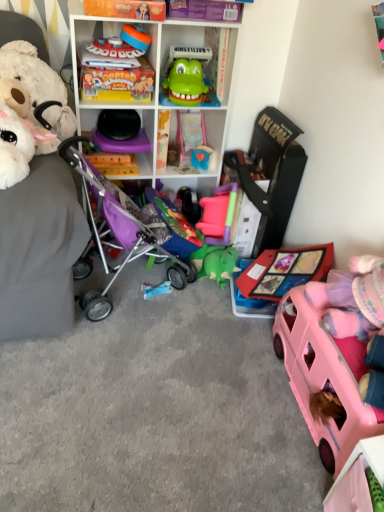
You are a GUI agent. You are given a task and a screenshot of the screen. Output one action in this format:
    pyautogui.click(x=<x>, y=<y>)
    Task: Click on the matte yellow book at upper center
    This screenshot has height=512, width=384.
    Given the screenshot: What is the action you would take?
    pyautogui.click(x=117, y=83)

Describe the element at coordinates (324, 377) in the screenshot. I see `pink plastic car at lower right, which is the 1th toy in right-to-left order` at that location.

Measure the distance between matte plastic game controller at upper center, the 2th toy in the left-to-right sequence, and camera.

5.20 feet.

In order to face green plastic toy at upper center, marked as the fifth toy in a left-to-right arrangement, should I rotate leftwards or rightwards?

It's best to rotate left around 0.121 degrees.

Locate an element on the screen. The image size is (384, 512). green plastic toy at upper center, marked as the fifth toy in a left-to-right arrangement is located at coordinates (186, 83).

Identify the location of matte yellow book at upper center. (117, 83).

Between pink plastic car at lower right, which is the 1th toy in right-to-left order, and white plastic shelf at upper center, which one is positioned behind?

white plastic shelf at upper center is further away from the camera.

From the image's perspective, is pink plastic car at lower right, positioned as the 7th toy in left-to-right order, below white plastic shelf at upper center?

Yes, from the image's perspective, pink plastic car at lower right, positioned as the 7th toy in left-to-right order, is below white plastic shelf at upper center.

Considering the relative sizes of pink plastic car at lower right, which is the 1th toy in right-to-left order, and white plastic shelf at upper center in the image provided, is pink plastic car at lower right, which is the 1th toy in right-to-left order, taller than white plastic shelf at upper center?

No, pink plastic car at lower right, which is the 1th toy in right-to-left order, is not taller than white plastic shelf at upper center.

Measure the distance from pink plastic car at lower right, positioned as the 7th toy in left-to-right order, to white plastic shelf at upper center.

The distance of pink plastic car at lower right, positioned as the 7th toy in left-to-right order, from white plastic shelf at upper center is 1.03 meters.

In the scene shown: Between blue matte toy at center, the second toy viewed from the right, and matte plastic toy at upper center, which is the 3th toy in left-to-right order, which one has smaller width?

Thinner between the two is blue matte toy at center, the second toy viewed from the right.

Considering the positions of point (192, 157) and point (142, 32), is point (192, 157) closer or farther from the camera than point (142, 32)?

Point (192, 157) is positioned farther from the camera compared to point (142, 32).

Is blue matte toy at center, which appears as the sixth toy when viewed from the left, directly adjacent to matte plastic toy at upper center, which is the 3th toy in left-to-right order?

No, blue matte toy at center, which appears as the sixth toy when viewed from the left, is not touching matte plastic toy at upper center, which is the 3th toy in left-to-right order.

Locate an element on the screen. The image size is (384, 512). book in front of the plastic toy car at center, the 4th toy in the left-to-right sequence is located at coordinates (117, 83).

Measure the distance between plastic toy car at center, the 4th toy in the left-to-right sequence, and matte yellow book at upper center.

plastic toy car at center, the 4th toy in the left-to-right sequence, and matte yellow book at upper center are 30.55 inches apart.

Is plastic toy car at center, the 4th toy in the left-to-right sequence, with matte yellow book at upper center?

No, plastic toy car at center, the 4th toy in the left-to-right sequence, is not touching matte yellow book at upper center.

Is plastic toy car at center, the 4th toy positioned from the right, to the right of matte yellow book at upper center from the viewer's perspective?

Yes, plastic toy car at center, the 4th toy positioned from the right, is to the right of matte yellow book at upper center.

Between blue matte toy at center, the second toy viewed from the right, and purple fabric baby carriage at left, which one is positioned behind?

blue matte toy at center, the second toy viewed from the right, is behind.

Measure the distance between blue matte toy at center, which appears as the sixth toy when viewed from the left, and purple fabric baby carriage at left.

A distance of 61.03 centimeters exists between blue matte toy at center, which appears as the sixth toy when viewed from the left, and purple fabric baby carriage at left.

Is blue matte toy at center, the second toy viewed from the right, outside of purple fabric baby carriage at left?

Indeed, blue matte toy at center, the second toy viewed from the right, is completely outside purple fabric baby carriage at left.

Looking at this image, how different are the orientations of blue matte toy at center, the second toy viewed from the right, and purple fabric baby carriage at left in degrees?

The angle between the facing direction of blue matte toy at center, the second toy viewed from the right, and the facing direction of purple fabric baby carriage at left is 133 degrees.

Which point is more forward, (349,454) or (163,293)?

Point (349,454)

From the picture: Could you tell me if pink plastic car at lower right, which is the 1th toy in right-to-left order, is facing plastic toy car at center, the 4th toy positioned from the right?

No, pink plastic car at lower right, which is the 1th toy in right-to-left order, does not turn towards plastic toy car at center, the 4th toy positioned from the right.

From the image's perspective, between pink plastic car at lower right, positioned as the 7th toy in left-to-right order, and plastic toy car at center, the 4th toy in the left-to-right sequence, which one is located above?

From the image's view, plastic toy car at center, the 4th toy in the left-to-right sequence, is above.

Can you see pink plastic car at lower right, positioned as the 7th toy in left-to-right order, touching plastic toy car at center, the 4th toy positioned from the right?

They are not placed beside each other.

Is point (89, 80) farther from viewer compared to point (209, 157)?

No, (89, 80) is closer to viewer.

Which object is closer to the camera, matte yellow book at upper center or blue matte toy at center, the second toy viewed from the right?

matte yellow book at upper center.

From the image's perspective, is matte yellow book at upper center above or below blue matte toy at center, which appears as the sixth toy when viewed from the left?

matte yellow book at upper center is situated higher than blue matte toy at center, which appears as the sixth toy when viewed from the left, in the image.

Does point (50, 114) come in front of point (103, 100)?

Yes, it is.

How far apart are fluffy white teddy bear at left, the 7th toy positioned from the right, and matte yellow book at upper center?

fluffy white teddy bear at left, the 7th toy positioned from the right, is 9.98 inches away from matte yellow book at upper center.

What's the angular difference between fluffy white teddy bear at left, the 7th toy positioned from the right, and matte yellow book at upper center's facing directions?

The facing directions of fluffy white teddy bear at left, the 7th toy positioned from the right, and matte yellow book at upper center are 5 degrees apart.

Is fluffy white teddy bear at left, which appears as the 1th toy when viewed from the left, in front of or behind matte yellow book at upper center in the image?

In the image, fluffy white teddy bear at left, which appears as the 1th toy when viewed from the left, appears in front of matte yellow book at upper center.

Where is `shelf located above the pink plastic car at lower right, positioned as the 7th toy in left-to-right order (from the image's perspective)`? The height and width of the screenshot is (512, 384). shelf located above the pink plastic car at lower right, positioned as the 7th toy in left-to-right order (from the image's perspective) is located at coordinates (189, 106).

From the blue matte toy at center, which appears as the sixth toy when viewed from the left, count the 3rd toy to the left and point to it. Please provide its 2D coordinates.

[(135, 37)]

From the image, which object appears to be nearer to matte plastic game controller at upper center, which is the 6th toy in right-to-left order, green plastic toy at upper center, which ranks as the third toy in right-to-left order, or matte plastic toy at upper center, which is the 3th toy in left-to-right order?

matte plastic toy at upper center, which is the 3th toy in left-to-right order, is positioned closer to the anchor matte plastic game controller at upper center, which is the 6th toy in right-to-left order.

Looking at this image, which object lies further to the anchor point white plastic shelf at upper center, green plastic toy at upper center or green plastic toy at upper center, which ranks as the third toy in right-to-left order?

The object further to white plastic shelf at upper center is green plastic toy at upper center, which ranks as the third toy in right-to-left order.

Estimate the real-world distances between objects in this image. Which object is closer to white plastic shelf at upper center, matte plastic toy at upper center, which is the 3th toy in left-to-right order, or plastic toy car at center, the 4th toy positioned from the right?

matte plastic toy at upper center, which is the 3th toy in left-to-right order, lies closer to white plastic shelf at upper center than the other object.

Which object lies further to the anchor point green plastic toy at upper center, green plastic toy at upper center, marked as the fifth toy in a left-to-right arrangement, or plastic toy car at center, the 4th toy in the left-to-right sequence?

plastic toy car at center, the 4th toy in the left-to-right sequence, lies further to green plastic toy at upper center than the other object.

Based on their spatial positions, is matte plastic game controller at upper center, the 2th toy in the left-to-right sequence, or matte plastic toy at upper center, which appears as the fifth toy when viewed from the right, further from fluffy white teddy bear at left, the 7th toy positioned from the right?

Among the two, matte plastic toy at upper center, which appears as the fifth toy when viewed from the right, is located further to fluffy white teddy bear at left, the 7th toy positioned from the right.

From the image, which object appears to be nearer to green plastic toy at upper center, green plastic toy at upper center, which ranks as the third toy in right-to-left order, or matte plastic game controller at upper center, the 2th toy in the left-to-right sequence?

The object closer to green plastic toy at upper center is green plastic toy at upper center, which ranks as the third toy in right-to-left order.

When comparing their distances from green plastic toy at upper center, which ranks as the third toy in right-to-left order, does fluffy white teddy bear at left, which appears as the 1th toy when viewed from the left, or plastic toy car at center, the 4th toy in the left-to-right sequence, seem further?

plastic toy car at center, the 4th toy in the left-to-right sequence, is positioned further to the anchor green plastic toy at upper center, which ranks as the third toy in right-to-left order.

Estimate the real-world distances between objects in this image. Which object is further from matte plastic toy at upper center, which appears as the fifth toy when viewed from the right, blue matte toy at center, which appears as the sixth toy when viewed from the left, or matte yellow book at upper center?

blue matte toy at center, which appears as the sixth toy when viewed from the left, is positioned further to the anchor matte plastic toy at upper center, which appears as the fifth toy when viewed from the right.

You are a GUI agent. You are given a task and a screenshot of the screen. Output one action in this format:
    pyautogui.click(x=<x>, y=<y>)
    Task: Click on the cabinet between matte plastic toy at upper center, which is the 3th toy in left-to-right order, and plastic toy car at center, the 4th toy in the left-to-right sequence, in the up-down direction
    The height and width of the screenshot is (512, 384).
    Given the screenshot: What is the action you would take?
    pyautogui.click(x=203, y=58)

Locate an element on the screen. Image resolution: width=384 pixels, height=512 pixels. cabinet between green plastic toy at upper center, which ranks as the third toy in right-to-left order, and blue matte toy at center, the second toy viewed from the right, from front to back is located at coordinates (203, 58).

In order to click on shelf that lies between green plastic toy at upper center, marked as the fifth toy in a left-to-right arrangement, and pink plastic car at lower right, which is the 1th toy in right-to-left order, from top to bottom in this screenshot , I will do `click(189, 106)`.

Where is `shelf between matte yellow book at upper center and green plastic toy at upper center from left to right`? shelf between matte yellow book at upper center and green plastic toy at upper center from left to right is located at coordinates (189, 106).